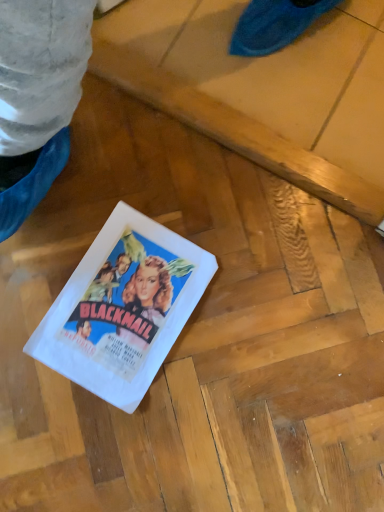
This screenshot has width=384, height=512. What do you see at coordinates (123, 308) in the screenshot?
I see `white matte book at center` at bounding box center [123, 308].

At what (x,y) coordinates should I click in order to perform the action: click on white matte book at center. Please return your answer as a coordinate pair (x, y). Looking at the image, I should click on (123, 308).

I want to click on white matte book at center, so click(123, 308).